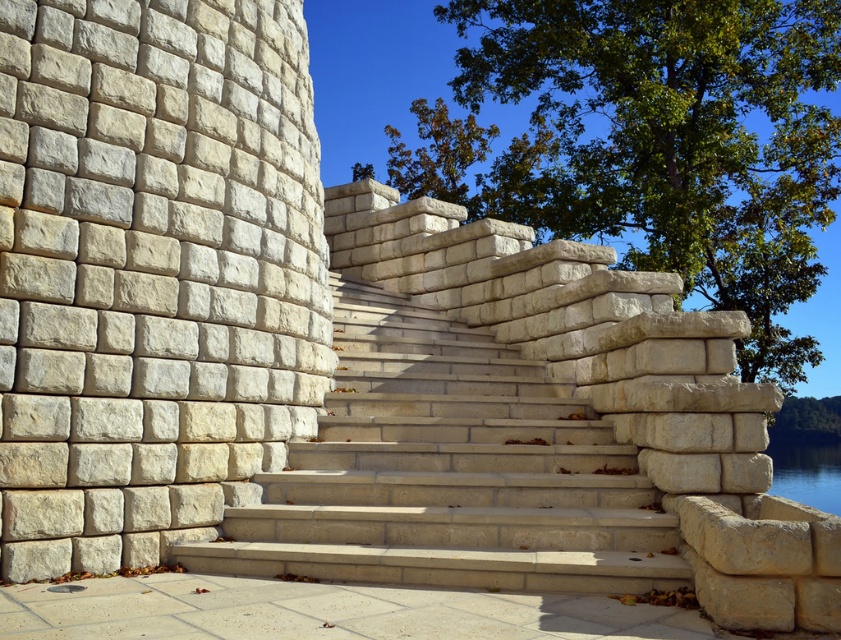
You are planning to place a large decorative statue that is 2 meters wide on the smooth concrete slab at lower center. Considering the beige stone stairs at center are narrower than the slab, will the statue fit on the slab?

The beige stone stairs at center are narrower than the smooth concrete slab at lower center, so the statue with 2 meters width can fit on the smooth concrete slab at lower center as it is wider than the stairs.

You are standing at the base of the beige stone stairs at center. If you walk straight ahead, will you eventually reach the tree with autumn leaves on the right?

The beige stone stairs at center are positioned to the left of the tree with autumn leaves on the right, so walking straight ahead along the stairs would lead you upwards away from the tree. To reach the tree, you would need to move to the right side of the stairs.

You are standing at the base of the beige stone stairs at center. Looking upward, where would you see the point marked at coordinate (448,472) on the staircase?

The point marked at coordinate (448,472) is located on the beige stone stairs at center, which is the middle section of the staircase.